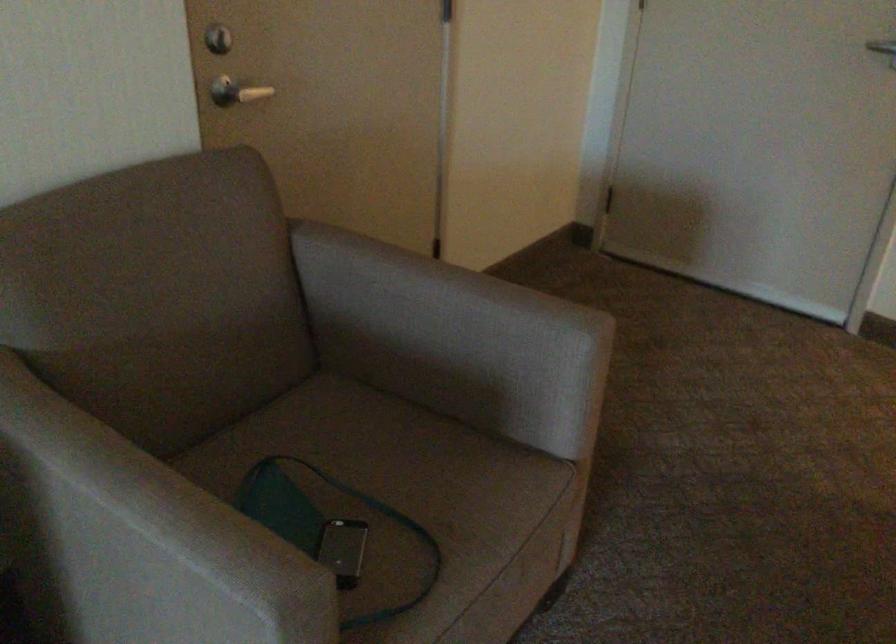
Where would you lift the green bag strap? Please return your answer as a coordinate pair (x, y).

(322, 526)